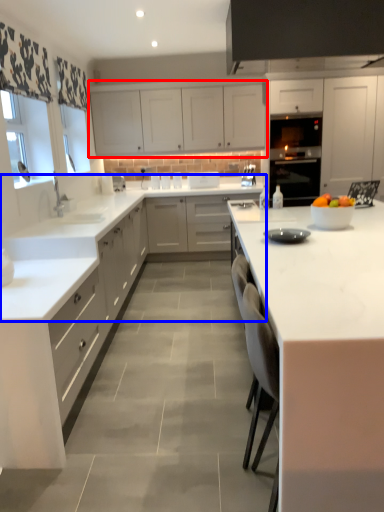
Question: Which object is closer to the camera taking this photo, cabinetry (highlighted by a red box) or countertop (highlighted by a blue box)?

Choices:
 (A) cabinetry
 (B) countertop

Answer: (B)